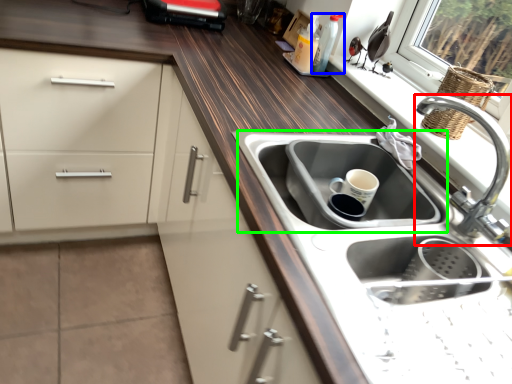
Question: Which is farther away from tap (highlighted by a red box)? bottle (highlighted by a blue box) or sink (highlighted by a green box)?

Choices:
 (A) bottle
 (B) sink

Answer: (A)